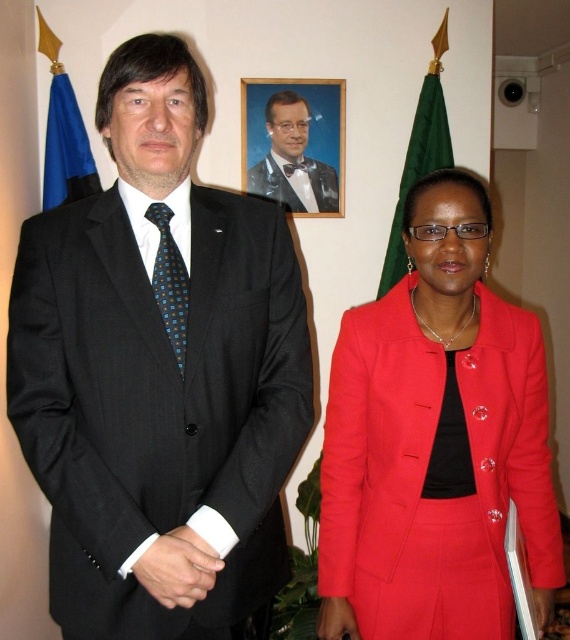
From the picture: You are standing in front of the two people in the image. You want to place a small plant between them at a position that is closer to you. Which of the two points, point (x=384, y=284) or point (x=185, y=296), should you choose?

You should choose point (x=185, y=296) because it is closer to you than point (x=384, y=284).

You are standing in a formal indoor setting with two people. There is a point at coordinates (435, 442). What object is located at that point?

The object at point (435, 442) is the matte red suit at center.